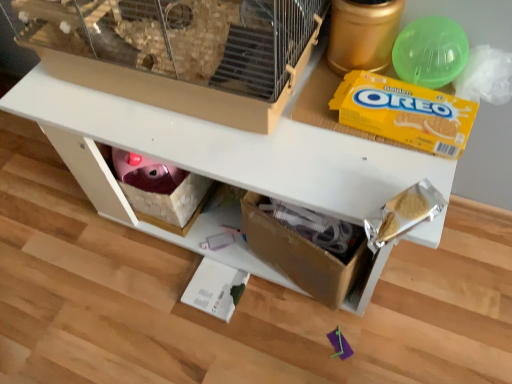
Question: Should I look upward or downward to see white matte table at center?

Choices:
 (A) up
 (B) down

Answer: (A)

Question: Can you confirm if yellow cardboard oreo at upper right is thinner than green plastic ball at upper right?

Choices:
 (A) yes
 (B) no

Answer: (B)

Question: Is green plastic ball at upper right inside yellow cardboard oreo at upper right?

Choices:
 (A) yes
 (B) no

Answer: (B)

Question: From a real-world perspective, is yellow cardboard oreo at upper right located higher than green plastic ball at upper right?

Choices:
 (A) yes
 (B) no

Answer: (B)

Question: From a real-world perspective, is yellow cardboard oreo at upper right positioned under green plastic ball at upper right based on gravity?

Choices:
 (A) yes
 (B) no

Answer: (A)

Question: Is yellow cardboard oreo at upper right not inside green plastic ball at upper right?

Choices:
 (A) no
 (B) yes

Answer: (B)

Question: Can you confirm if yellow cardboard oreo at upper right is taller than green plastic ball at upper right?

Choices:
 (A) no
 (B) yes

Answer: (A)

Question: Is green plastic ball at upper right to the right of yellow cardboard oreo at upper right from the viewer's perspective?

Choices:
 (A) yes
 (B) no

Answer: (A)

Question: Could you tell me if green plastic ball at upper right is facing yellow cardboard oreo at upper right?

Choices:
 (A) yes
 (B) no

Answer: (A)

Question: From the image's perspective, does green plastic ball at upper right appear lower than yellow cardboard oreo at upper right?

Choices:
 (A) yes
 (B) no

Answer: (B)

Question: From the image's perspective, is green plastic ball at upper right located above yellow cardboard oreo at upper right?

Choices:
 (A) yes
 (B) no

Answer: (A)

Question: Is green plastic ball at upper right positioned before yellow cardboard oreo at upper right?

Choices:
 (A) yes
 (B) no

Answer: (B)

Question: From a real-world perspective, is green plastic ball at upper right beneath yellow cardboard oreo at upper right?

Choices:
 (A) no
 (B) yes

Answer: (A)

Question: From a real-world perspective, is white matte table at center located higher than yellow cardboard oreo at upper right?

Choices:
 (A) yes
 (B) no

Answer: (B)